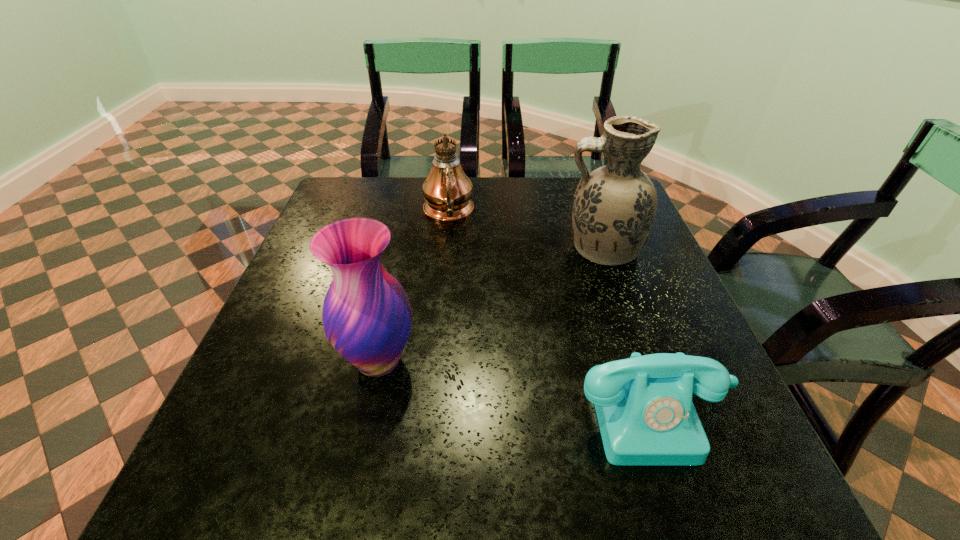
Where is `empty location between the oil lamp and the farther vase`? The image size is (960, 540). empty location between the oil lamp and the farther vase is located at coordinates (525, 231).

You are a GUI agent. You are given a task and a screenshot of the screen. Output one action in this format:
    pyautogui.click(x=<x>, y=<y>)
    Task: Click on the object that is the second closest to the shortest object
    The image size is (960, 540).
    Given the screenshot: What is the action you would take?
    pyautogui.click(x=367, y=316)

Choose which object is the nearest neighbor to the right vase. Please provide its 2D coordinates. Your answer should be formatted as a tuple, i.e. [(x, y)], where the tuple contains the x and y coordinates of a point satisfying the conditions above.

[(447, 190)]

You are a GUI agent. You are given a task and a screenshot of the screen. Output one action in this format:
    pyautogui.click(x=<x>, y=<y>)
    Task: Click on the vacant area in the image that satisfies the following two spatial constraints: 1. on the back side of the nearer vase; 2. with the handle on the side of the farther vase
    This screenshot has height=540, width=960.
    Given the screenshot: What is the action you would take?
    pyautogui.click(x=403, y=249)